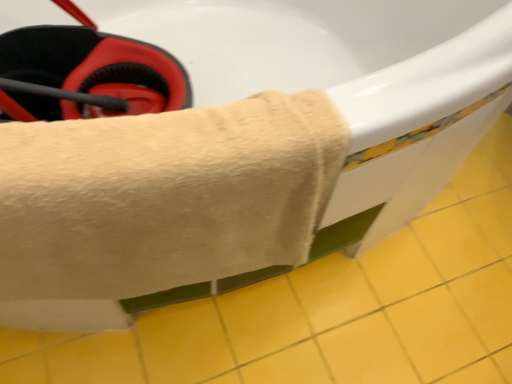
Locate an element on the screen. beige cotton towel at upper center is located at coordinates tap(164, 196).

What do you see at coordinates (164, 196) in the screenshot?
I see `beige cotton towel at upper center` at bounding box center [164, 196].

Identify the location of beige cotton towel at upper center. The height and width of the screenshot is (384, 512). (164, 196).